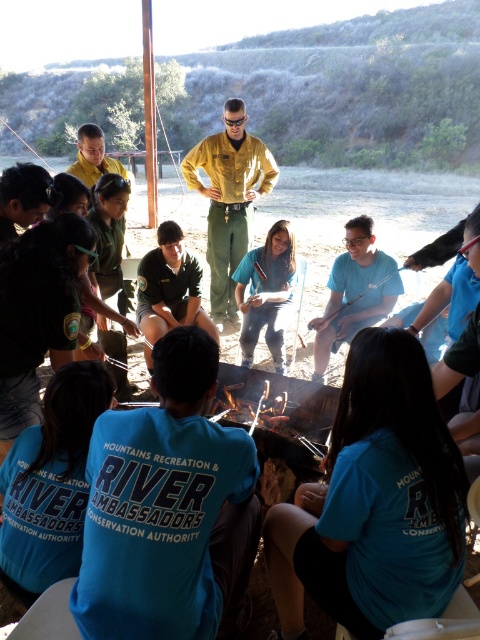
Looking at this image, you are standing at the edge of the campfire area and want to locate the blue fabric shirt at center. According to the coordinates provided, in which direction should you look relative to your current position?

You should look towards the center of the image, specifically at point coordinates (x=266, y=292), which is the location of the blue fabric shirt at center.

You are a photographer standing at the edge of the campfire area. You want to take a photo that includes both the blue fabric shirt at center and the charcoal wood fire at center. Which object should you focus on first if you want the other to be in the background?

The blue fabric shirt at center is positioned over the charcoal wood fire at center, so you should focus on the blue fabric shirt at center first to have the charcoal wood fire at center in the background.